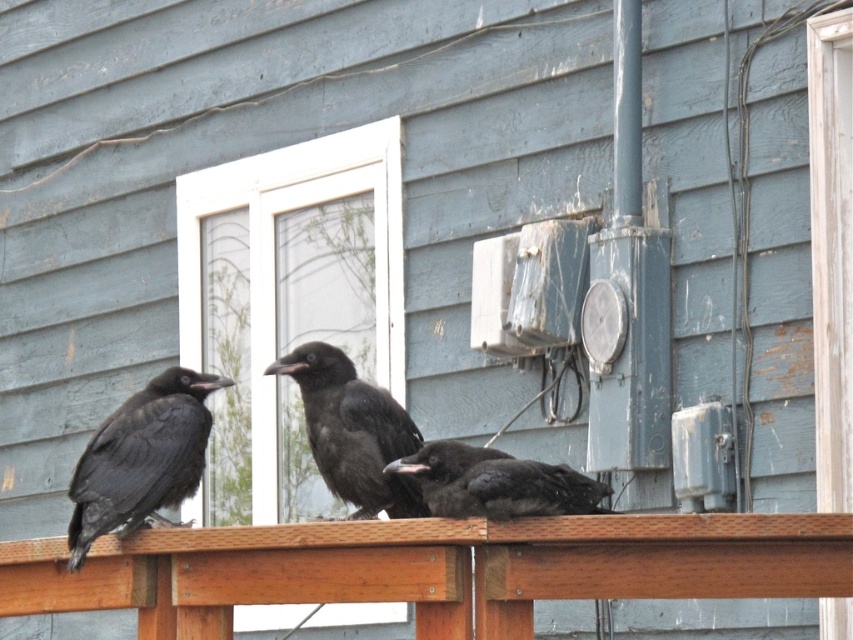
You are a birdwatcher observing the three black birds on the wooden railing. You notice the shiny black raven at left and the black matte bird at center. Which of these two birds is positioned lower on the railing?

The shiny black raven at left is positioned below the black matte bird at center, so it is lower on the railing.

You are a birdwatcher observing the three black birds on the wooden railing in front of the weathered bluegray wooden house. You notice the shiny black raven at left and the shiny black raven at center. Which of these two ravens is positioned lower on the railing?

The shiny black raven at left is positioned lower on the railing than the shiny black raven at center.

You are a birdwatcher trying to identify the birds in the image. The scene has a wooden railing in front of a weathered blue gray house with a white framed window. You notice a point marked at coordinate (141, 458). What bird is located at this point?

The point at coordinate (141, 458) marks a shiny black raven at left.